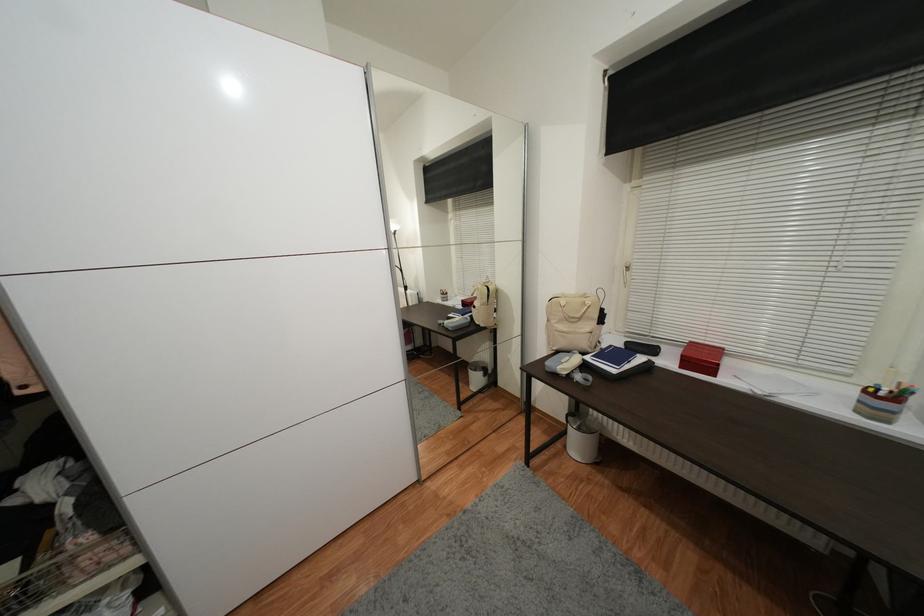
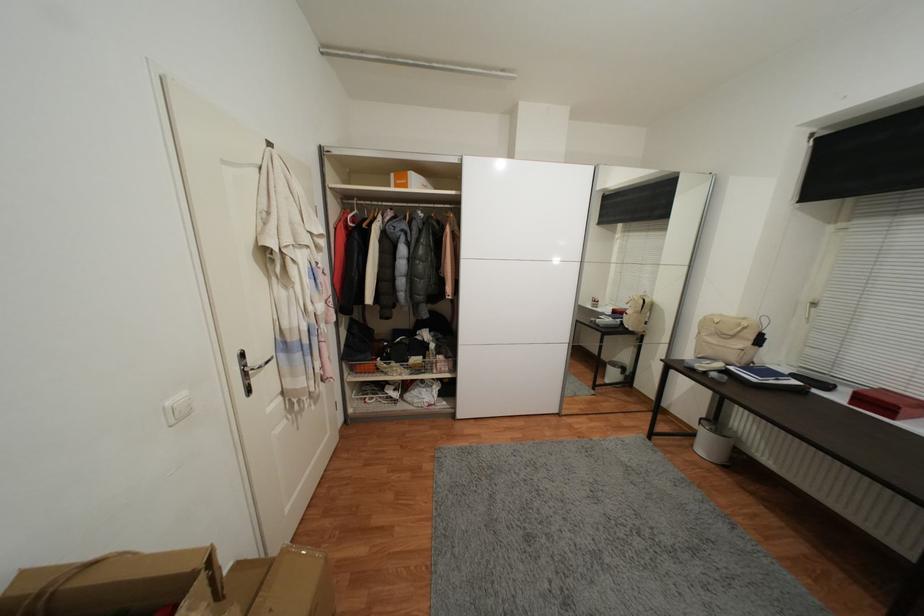
Where in the second image is the point corresponding to (659,352) from the first image?

(831, 387)